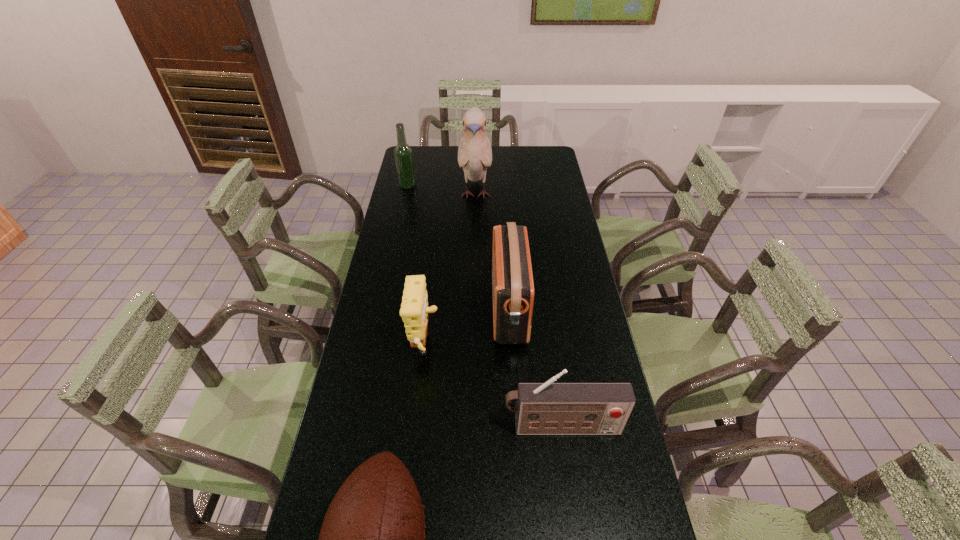
The height and width of the screenshot is (540, 960). Find the location of `blank space located on the front panel of the second nearest object`. blank space located on the front panel of the second nearest object is located at coordinates (571, 492).

Identify the location of free space located 0.170m on the face of the sponge. (497, 351).

Locate an element on the screen. The height and width of the screenshot is (540, 960). liquor situated at the left edge is located at coordinates (403, 154).

This screenshot has height=540, width=960. I want to click on sponge situated at the left edge, so click(x=414, y=310).

Find the location of a particular element. object that is at the right edge is located at coordinates (548, 408).

Identify the location of vacant area at the far edge of the desktop. The width and height of the screenshot is (960, 540). (443, 152).

Find the location of a particular element. The image size is (960, 540). vacant space at the left edge is located at coordinates (327, 481).

Identify the location of vacant space at the right edge of the desktop. (575, 264).

Identify the location of vacant region at the far left corner. (423, 159).

At what (x,y) coordinates should I click in order to perform the action: click on free space between the sponge and the liquor. Please return your answer as a coordinate pair (x, y). Looking at the image, I should click on (417, 268).